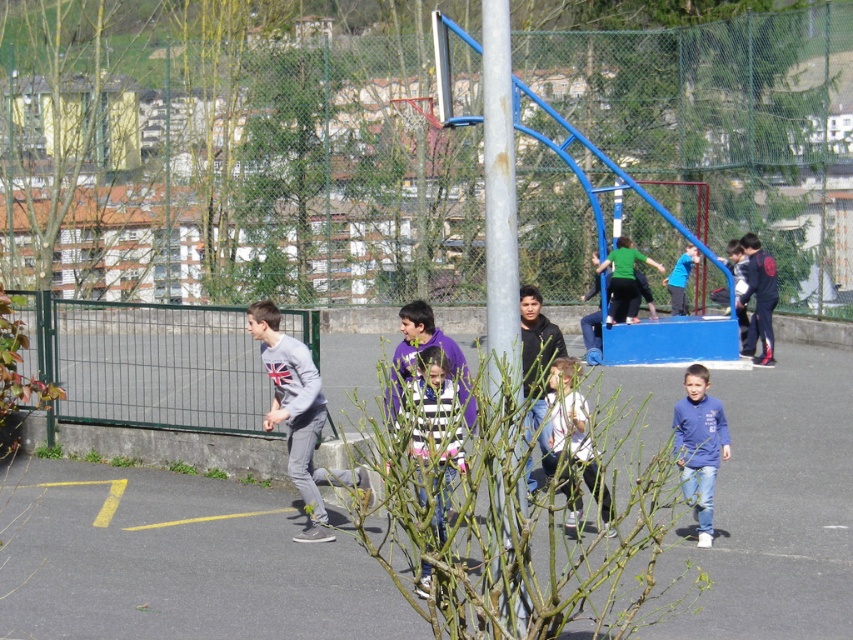
You are a photographer trying to capture a photo of the two people wearing the gray cotton sweatshirt at center and the striped fabric shirt at center. From which side of the two people should you stand to ensure both are fully visible in the frame?

You should stand to the right side of the two people because the gray cotton sweatshirt at center is positioned on the left side of the striped fabric shirt at center, so standing to the right would allow both to be visible without one blocking the other.

You are a photographer standing at the edge of the basketball court. You want to take a picture of the white matte jacket at center and the blue fleece jacket at upper center so that both are visible in the frame. Based on their positions, which jacket should you position closer to the left side of the camera frame?

The white matte jacket at center is to the left of the blue fleece jacket at upper center, so you should position the white matte jacket at center closer to the left side of the camera frame to include both in the shot.

You are standing at the basketball hoop and looking towards the residential buildings. There are two points marked in the image. Which point, point [306,484] or point [427,397], is closer to the fence?

Point [427,397] is closer to the fence because point [306,484] is behind point [427,397], meaning it is farther away from the fence.